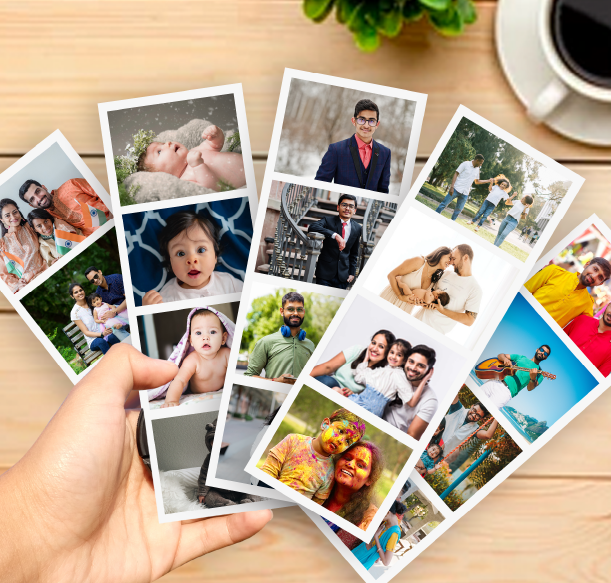
I want to click on photo cards, so click(68, 249), click(353, 178), click(195, 196), click(555, 345), click(463, 216).